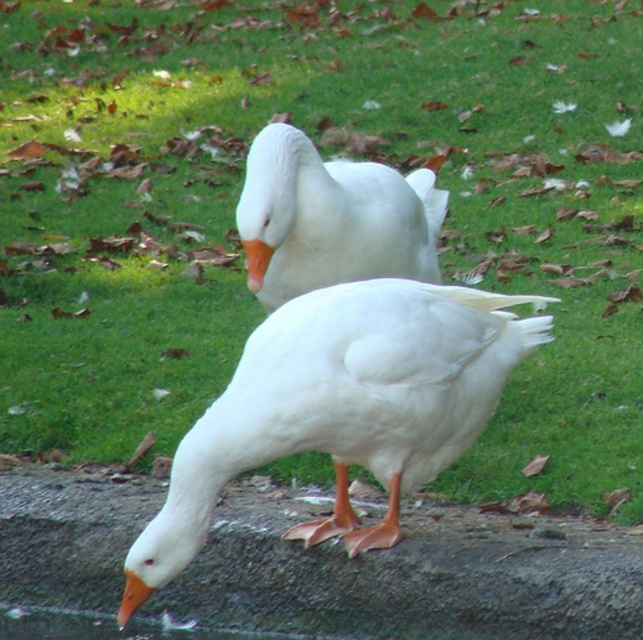
Can you confirm if concrete at lower left is bigger than orange matte beak at lower left?

Indeed, concrete at lower left has a larger size compared to orange matte beak at lower left.

Consider the image. Who is more forward, (523,589) or (123,593)?

Positioned in front is point (123,593).

Is point (397, 586) less distant than point (131, 614)?

No.

You are a GUI agent. You are given a task and a screenshot of the screen. Output one action in this format:
    pyautogui.click(x=<x>, y=<y>)
    Task: Click on the concrete at lower left
    The height and width of the screenshot is (640, 643).
    Given the screenshot: What is the action you would take?
    pyautogui.click(x=412, y=577)

Can you confirm if white feathered duck at center is positioned to the right of orange matte beak at center?

Correct, you'll find white feathered duck at center to the right of orange matte beak at center.

Can you confirm if white feathered duck at center is thinner than orange matte beak at center?

No.

Is point (370, 316) closer to viewer compared to point (264, 273)?

No, it is not.

Locate an element on the screen. white feathered duck at center is located at coordinates (347, 404).

At what (x,y) coordinates should I click in order to perform the action: click on white matte goose at center. Please return your answer as a coordinate pair (x, y). Image resolution: width=643 pixels, height=640 pixels. Looking at the image, I should click on (334, 216).

Does white matte goose at center lie in front of orange matte beak at lower left?

That is False.

Who is more forward, (273, 220) or (123, 625)?

Point (123, 625) is in front.

Where is `white matte goose at center`? Image resolution: width=643 pixels, height=640 pixels. white matte goose at center is located at coordinates (334, 216).